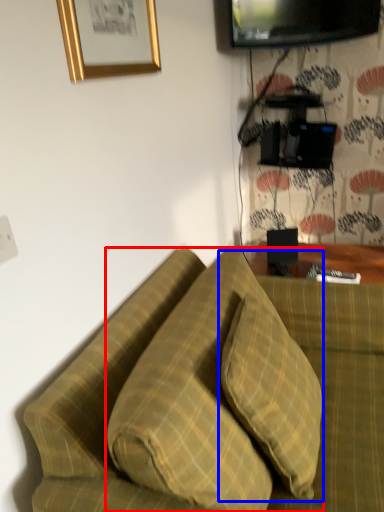
Question: Among these objects, which one is farthest to the camera, pillow (highlighted by a red box) or pillow (highlighted by a blue box)?

Choices:
 (A) pillow
 (B) pillow

Answer: (B)